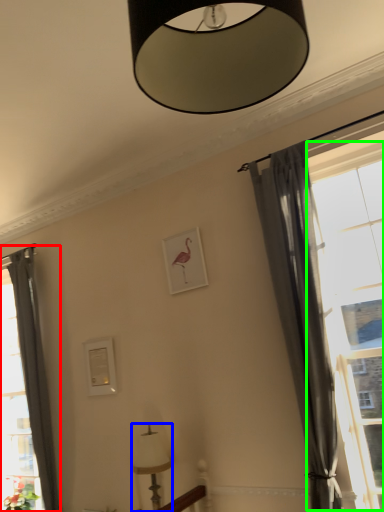
Question: Considering the real-world distances, which object is closest to curtain (highlighted by a red box)? lamp (highlighted by a blue box) or window (highlighted by a green box).

Choices:
 (A) lamp
 (B) window

Answer: (A)